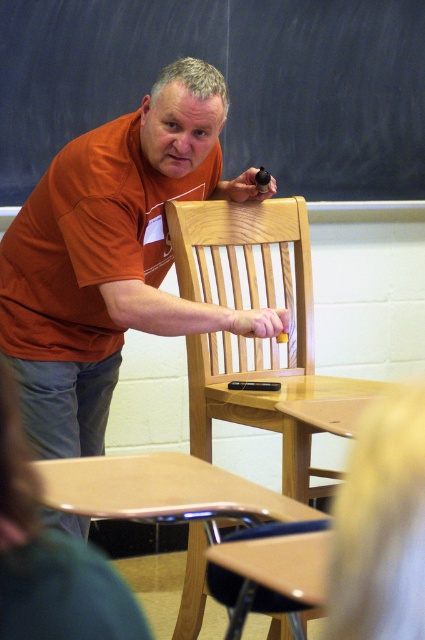
Question: Based on their relative distances, which object is nearer to the wooden chair at center?

Choices:
 (A) matte orange shirt at center
 (B) blue fabric shirt at lower left
 (C) black chalkboard at upper center

Answer: (A)

Question: Does black chalkboard at upper center have a larger size compared to blue fabric shirt at lower left?

Choices:
 (A) yes
 (B) no

Answer: (A)

Question: Can you confirm if matte orange shirt at center is positioned below wooden chair at center?

Choices:
 (A) yes
 (B) no

Answer: (B)

Question: Which point is closer to the camera?

Choices:
 (A) (50, 435)
 (B) (51, 554)
 (C) (272, 202)
 (D) (402, 83)

Answer: (B)

Question: Which point is farther to the camera?

Choices:
 (A) (316, 387)
 (B) (195, 108)

Answer: (A)

Question: Is black chalkboard at upper center to the left of wooden chair at center from the viewer's perspective?

Choices:
 (A) yes
 (B) no

Answer: (A)